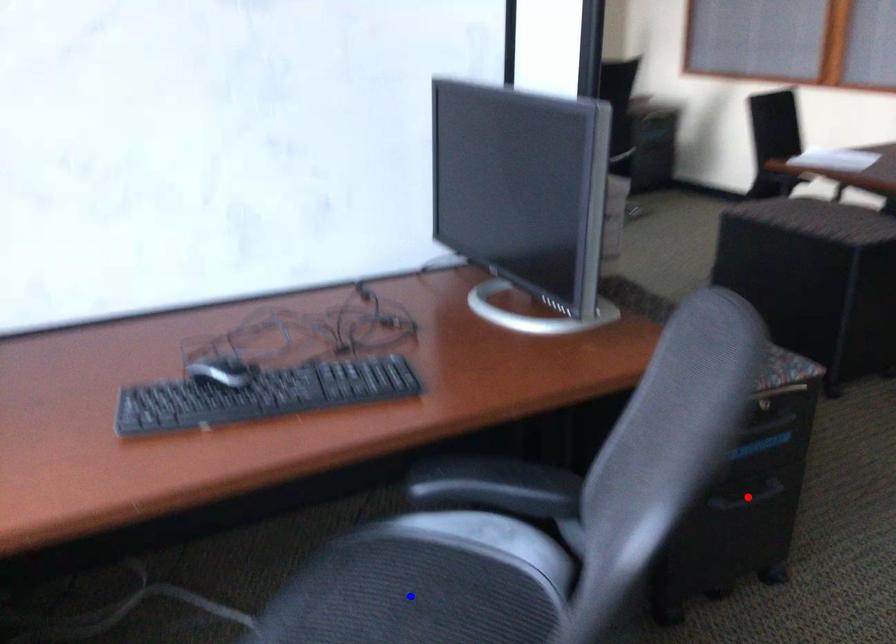
Question: Two points are marked on the image. Which point is closer to the camera?

Choices:
 (A) Blue point is closer.
 (B) Red point is closer.

Answer: (A)